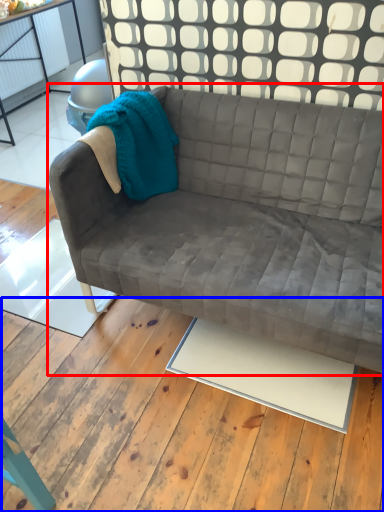
Question: Which object is further to the camera taking this photo, studio couch (highlighted by a red box) or plywood (highlighted by a blue box)?

Choices:
 (A) studio couch
 (B) plywood

Answer: (A)